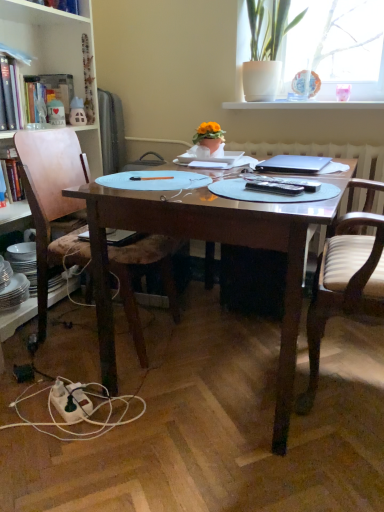
Question: In the image, is wooden bookcase at left positioned in front of or behind white striped wood chair at right, the first chair positioned from the right?

Choices:
 (A) behind
 (B) front

Answer: (A)

Question: In terms of size, does wooden bookcase at left appear bigger or smaller than white striped wood chair at right, marked as the second chair in a left-to-right arrangement?

Choices:
 (A) big
 (B) small

Answer: (A)

Question: Which object is positioned farthest from the matte white book at upper left, the 1th book from the back?

Choices:
 (A) wooden desk at center
 (B) white ceramic house at upper left, which is counted as the second toy, starting from the left
 (C) white ceramic pot at upper right
 (D) white glossy window sill at upper center
 (E) wooden chair at left, acting as the first chair starting from the left

Answer: (A)

Question: Estimate the real-world distances between objects in this image. Which object is closer to the silver metallic laptop at center?

Choices:
 (A) white ceramic house at upper left, which is counted as the second toy, starting from the left
 (B) wooden bookcase at left
 (C) white striped wood chair at right, marked as the second chair in a left-to-right arrangement
 (D) white plastic power outlet at lower left
 (E) hardcover book at left, which is the second book from back to front

Answer: (C)